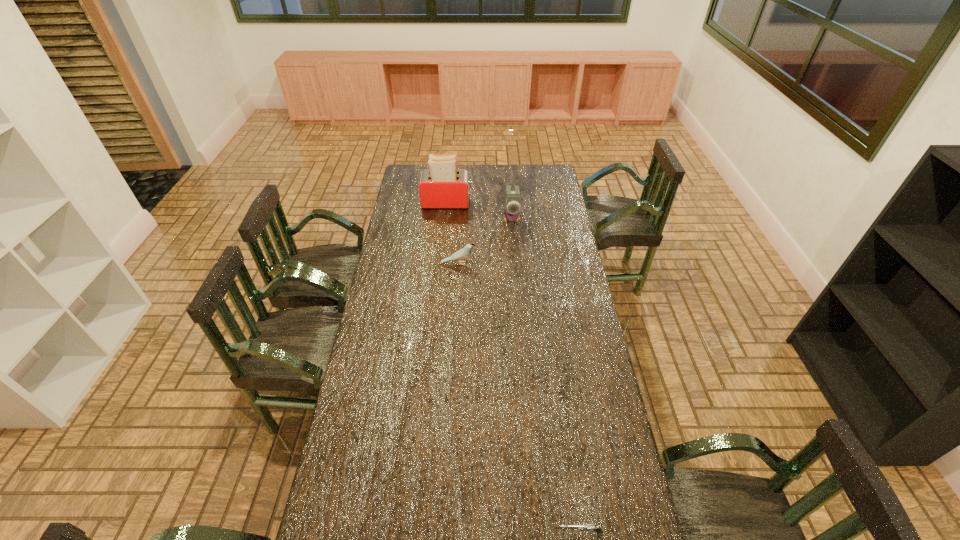
Locate an element on the screen. The width and height of the screenshot is (960, 540). the tallest object is located at coordinates (442, 186).

Find the location of a particular element. the second tallest object is located at coordinates (511, 213).

The width and height of the screenshot is (960, 540). Find the location of `the taller bird`. the taller bird is located at coordinates (511, 213).

This screenshot has width=960, height=540. What are the coordinates of `the nearer bird` in the screenshot? It's located at (464, 252).

You are a GUI agent. You are given a task and a screenshot of the screen. Output one action in this format:
    pyautogui.click(x=<x>, y=<y>)
    Task: Click on the second nearest object
    This screenshot has width=960, height=540.
    Given the screenshot: What is the action you would take?
    pyautogui.click(x=464, y=252)

Where is `pistol`? The image size is (960, 540). pistol is located at coordinates (590, 527).

Locate an element on the screen. Image resolution: width=960 pixels, height=540 pixels. the shortest object is located at coordinates (590, 527).

Image resolution: width=960 pixels, height=540 pixels. What are the coordinates of `blank space located 0.290m on the front-facing side of the tallest object` in the screenshot? It's located at (525, 203).

The image size is (960, 540). I want to click on free region located at the beak of the right bird, so click(515, 256).

Locate an element on the screen. vacant space located at the face of the second nearest object is located at coordinates (518, 264).